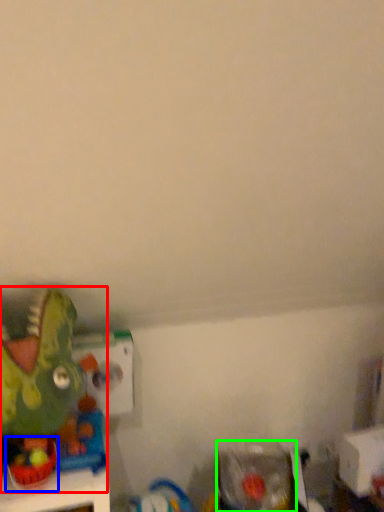
Question: Which object is positioned farthest from toy (highlighted by a red box)? Select from toy (highlighted by a blue box) and toy (highlighted by a green box).

Choices:
 (A) toy
 (B) toy

Answer: (B)